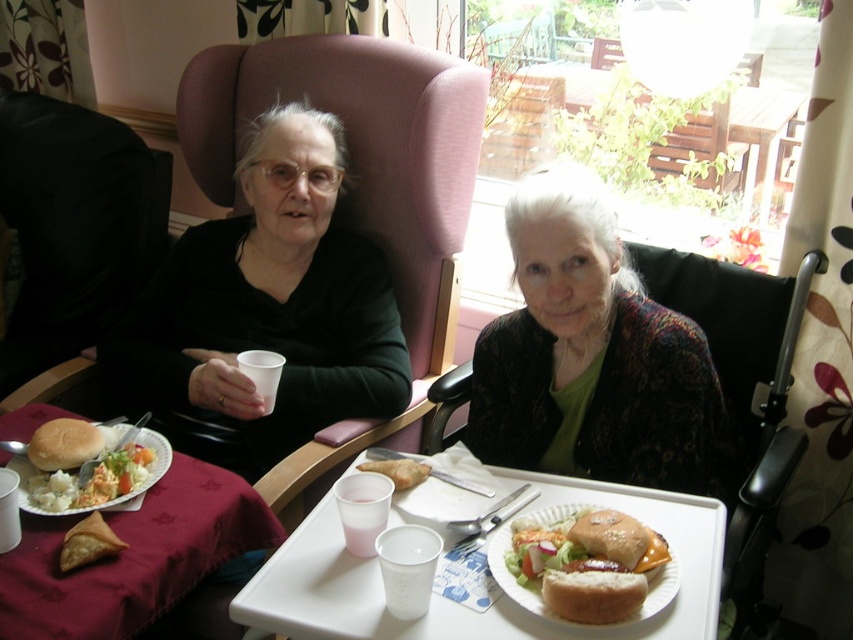
Question: Can you confirm if matte black sweater at upper left is wider than breaded bun at lower center?

Choices:
 (A) yes
 (B) no

Answer: (A)

Question: Does matte black cup at left appear under pink plastic cup at center?

Choices:
 (A) no
 (B) yes

Answer: (A)

Question: Does white plastic tray at center lie in front of breaded bun at lower center?

Choices:
 (A) yes
 (B) no

Answer: (A)

Question: Which object is positioned farthest from the black fabric chair at center?

Choices:
 (A) marble table at lower left
 (B) golden brown crispy chicken leg at center
 (C) white paper cup at center

Answer: (A)

Question: Which of these objects is positioned closest to the matte black cup at left?

Choices:
 (A) black fabric chair at center
 (B) marble table at lower left
 (C) pink plastic cup at center
 (D) white paper cup at center

Answer: (B)

Question: Which object is positioned farthest from the golden brown crispy chicken leg at center?

Choices:
 (A) white paper cup at center
 (B) pink plastic cup at center
 (C) black fabric chair at center
 (D) white plastic tray at center

Answer: (C)